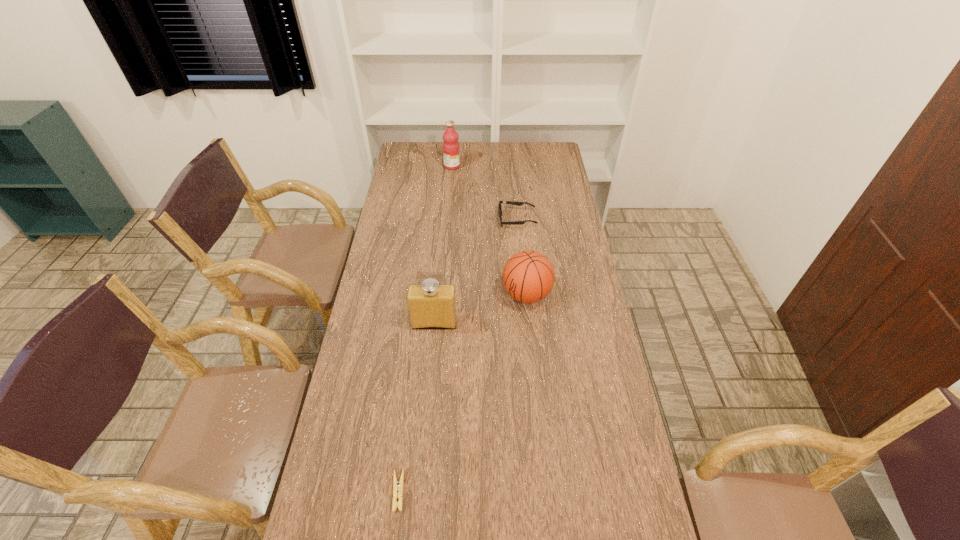
I want to click on free space between the second nearest object and the basketball, so click(480, 309).

At what (x,y) coordinates should I click in order to perform the action: click on empty location between the basketball and the perfume. Please return your answer as a coordinate pair (x, y). Looking at the image, I should click on (480, 309).

You are a GUI agent. You are given a task and a screenshot of the screen. Output one action in this format:
    pyautogui.click(x=<x>, y=<y>)
    Task: Click on the free point between the second shortest object and the second nearest object
    The width and height of the screenshot is (960, 540).
    Given the screenshot: What is the action you would take?
    475,271

I want to click on vacant area that lies between the nearest object and the third nearest object, so click(463, 393).

Where is `vacant area that lies between the second shortest object and the perfume`? The image size is (960, 540). vacant area that lies between the second shortest object and the perfume is located at coordinates 475,271.

Locate an element on the screen. This screenshot has height=540, width=960. empty location between the perfume and the third tallest object is located at coordinates (480, 309).

Where is `free space between the second farthest object and the fruit juice`? Image resolution: width=960 pixels, height=540 pixels. free space between the second farthest object and the fruit juice is located at coordinates (485, 193).

At what (x,y) coordinates should I click in order to perform the action: click on free spot between the second shortest object and the nearest object. Please return your answer as a coordinate pair (x, y). Looking at the image, I should click on [x=458, y=355].

Where is `vacant area that lies between the third tallest object and the clothespin`? vacant area that lies between the third tallest object and the clothespin is located at coordinates [x=463, y=393].

The height and width of the screenshot is (540, 960). Identify the location of the second closest object to the third shortest object. (506, 202).